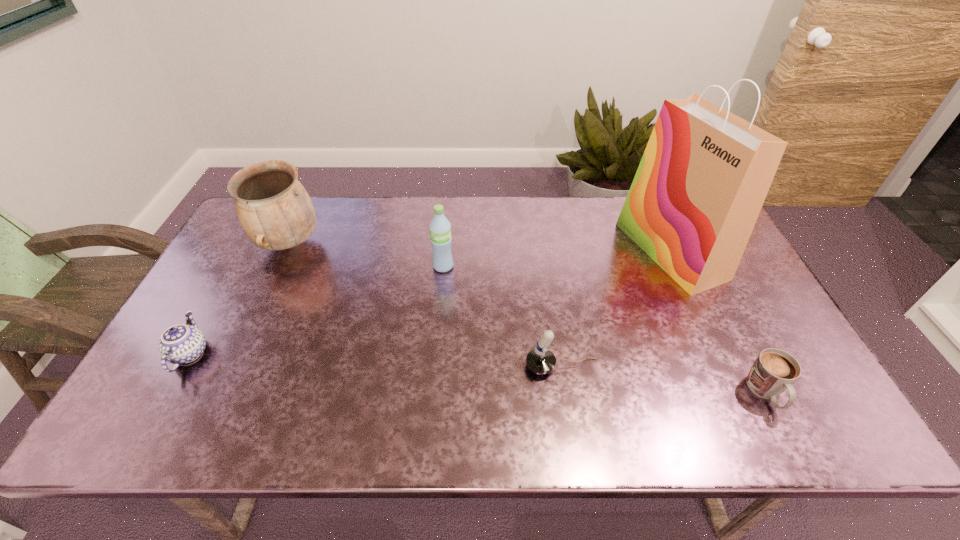
The height and width of the screenshot is (540, 960). In order to click on free region located 0.050m on the right of the third object from right to left in this screenshot , I will do `click(618, 366)`.

At what (x,y) coordinates should I click in order to perform the action: click on free region located 0.350m at the spout of the chinaware. Please return your answer as a coordinate pair (x, y). The width and height of the screenshot is (960, 540). Looking at the image, I should click on (348, 354).

The image size is (960, 540). Identify the location of vacant region located 0.050m on the side of the mug with the handle. (789, 439).

This screenshot has height=540, width=960. Identify the location of shopping bag that is at the far edge. (705, 173).

At what (x,y) coordinates should I click in order to perform the action: click on urn at the far edge. Please return your answer as a coordinate pair (x, y). This screenshot has height=540, width=960. Looking at the image, I should click on (274, 209).

You are a GUI agent. You are given a task and a screenshot of the screen. Output one action in this format:
    pyautogui.click(x=<x>, y=<y>)
    Task: Click on the object that is at the near edge
    This screenshot has width=960, height=540.
    Given the screenshot: What is the action you would take?
    pyautogui.click(x=774, y=371)

I want to click on urn that is at the left edge, so click(274, 209).

Where is `chinaware positioned at the left edge`? This screenshot has height=540, width=960. chinaware positioned at the left edge is located at coordinates (180, 344).

Where is `shopping bag present at the right edge`? The image size is (960, 540). shopping bag present at the right edge is located at coordinates (705, 173).

You are a GUI agent. You are given a task and a screenshot of the screen. Output one action in this format:
    pyautogui.click(x=<x>, y=<y>)
    Task: Click on the mug present at the right edge
    Image resolution: width=960 pixels, height=540 pixels.
    Given the screenshot: What is the action you would take?
    pyautogui.click(x=774, y=371)